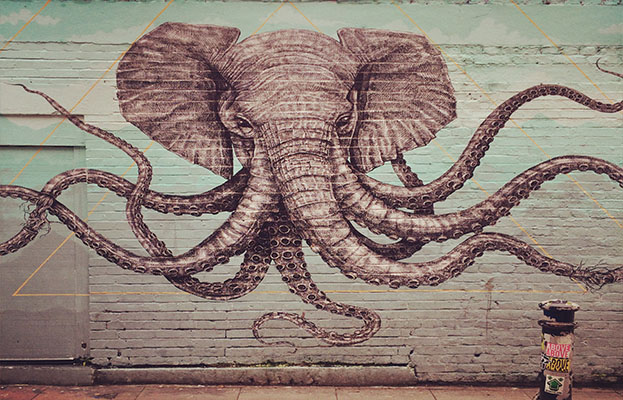
Find the location of a particular element. brick wall is located at coordinates 435,326.